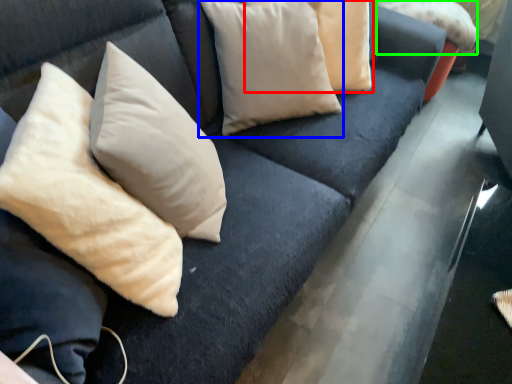
Question: Considering the real-world distances, which object is closest to pillow (highlighted by a red box)? pillow (highlighted by a blue box) or pillow (highlighted by a green box).

Choices:
 (A) pillow
 (B) pillow

Answer: (A)